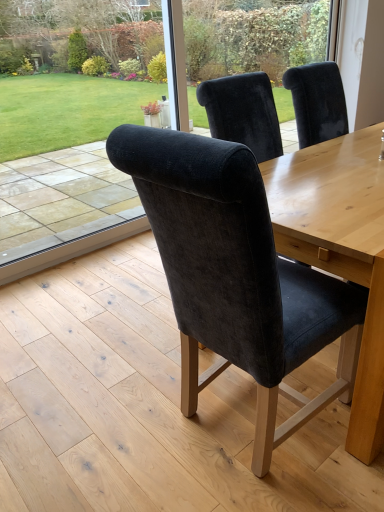
Find the location of `free space in front of velvet chair back at center`. free space in front of velvet chair back at center is located at coordinates (92, 301).